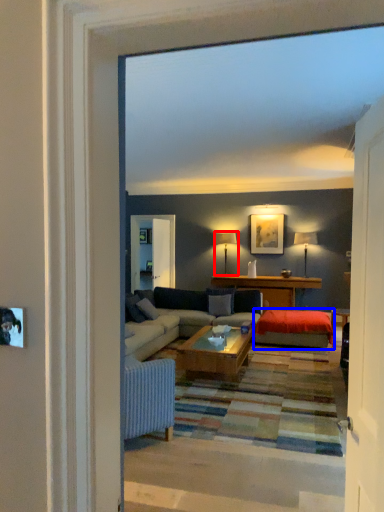
Question: Among these objects, which one is farthest to the camera, lamp (highlighted by a red box) or wide (highlighted by a blue box)?

Choices:
 (A) lamp
 (B) wide

Answer: (A)